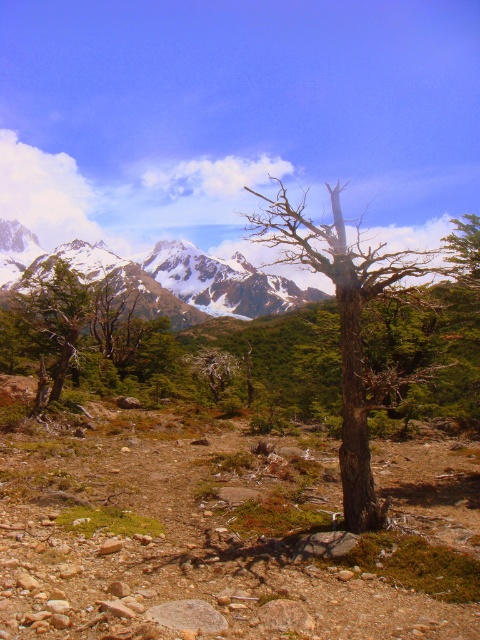
Question: Which point is closer to the camera?

Choices:
 (A) white snow-covered mountain range at upper left
 (B) green matte tree at left

Answer: (B)

Question: Is white snow-covered mountain range at upper left smaller than green matte tree at left?

Choices:
 (A) yes
 (B) no

Answer: (B)

Question: Based on their relative distances, which object is farther from the brown rough tree at center?

Choices:
 (A) white snow-covered mountain range at upper left
 (B) green matte tree at left

Answer: (B)

Question: Is white snow-covered mountain range at upper left wider than green matte tree at left?

Choices:
 (A) yes
 (B) no

Answer: (A)

Question: Estimate the real-world distances between objects in this image. Which object is farther from the green matte tree at left?

Choices:
 (A) brown rough tree at center
 (B) white snow-covered mountain range at upper left

Answer: (A)

Question: Is brown rough tree at center above green matte tree at left?

Choices:
 (A) no
 (B) yes

Answer: (B)